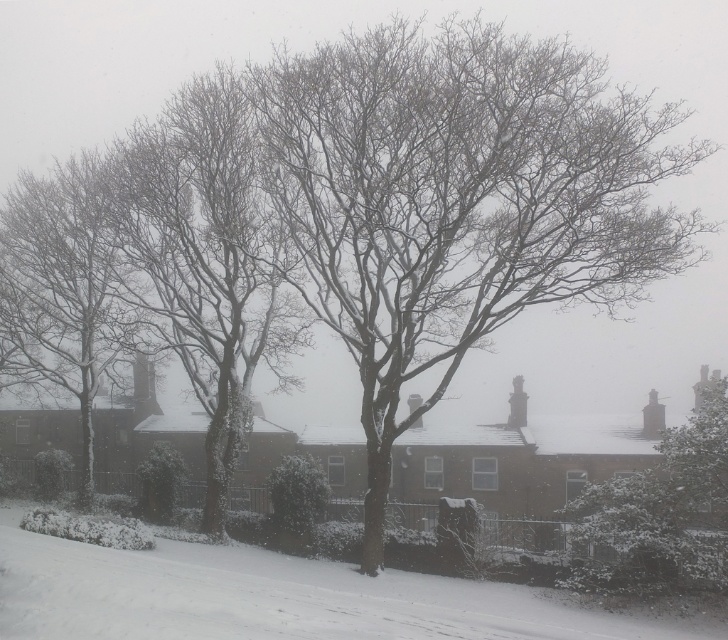
Which is above, bare branches at center or bare branches at left?

Positioned higher is bare branches at center.

Is bare branches at center closer to camera compared to bare branches at left?

Yes, bare branches at center is in front of bare branches at left.

Identify the location of bare branches at center. (458, 198).

Who is positioned more to the left, white fluffy snow at lower center or snow-covered tree at center?

From the viewer's perspective, white fluffy snow at lower center appears more on the left side.

The image size is (728, 640). Describe the element at coordinates (273, 596) in the screenshot. I see `white fluffy snow at lower center` at that location.

I want to click on white fluffy snow at lower center, so click(273, 596).

Who is shorter, bare branches at left or snow-covered tree at center?

snow-covered tree at center is shorter.

Can you confirm if bare branches at left is positioned below snow-covered tree at center?

Incorrect, bare branches at left is not positioned below snow-covered tree at center.

This screenshot has height=640, width=728. In order to click on bare branches at left in this screenshot , I will do `click(205, 259)`.

The image size is (728, 640). I want to click on bare branches at left, so click(205, 259).